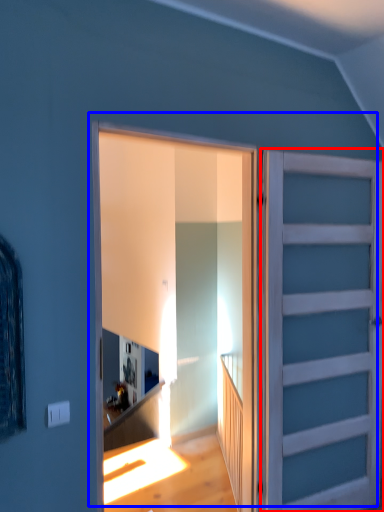
Question: Which object is closer to the camera taking this photo, door (highlighted by a red box) or door (highlighted by a blue box)?

Choices:
 (A) door
 (B) door

Answer: (B)